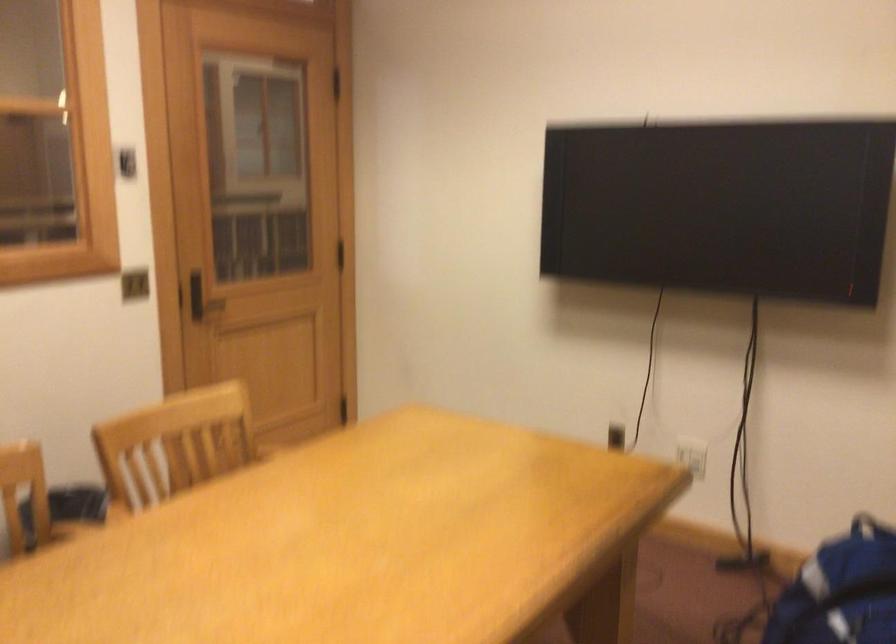
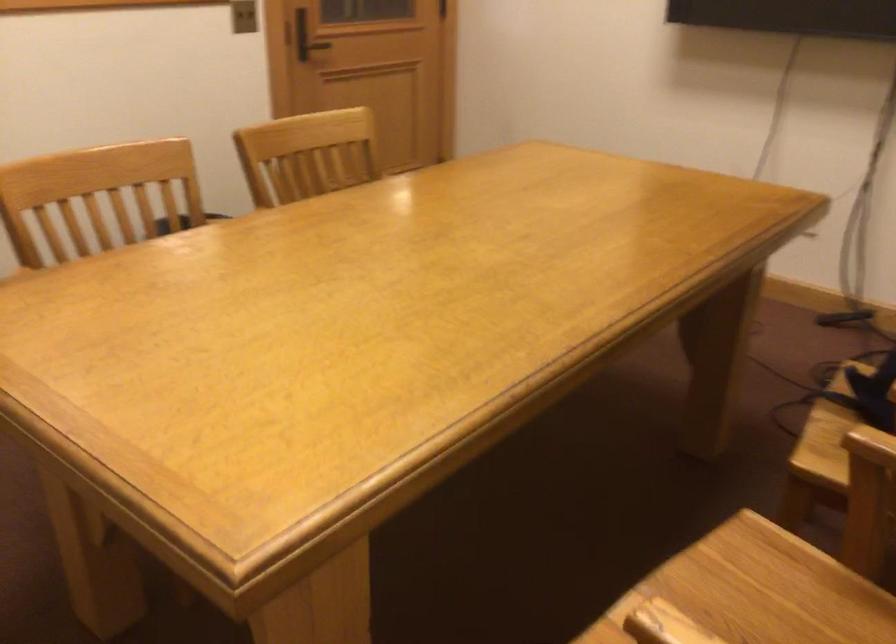
Question: I am providing you with two images of the same scene from different viewpoints. After the viewpoint changes to image2, which objects are now occluded?

Choices:
 (A) chair sitting surface
 (B) silver bottle
 (C) black door handle
 (D) white power outlet

Answer: (D)